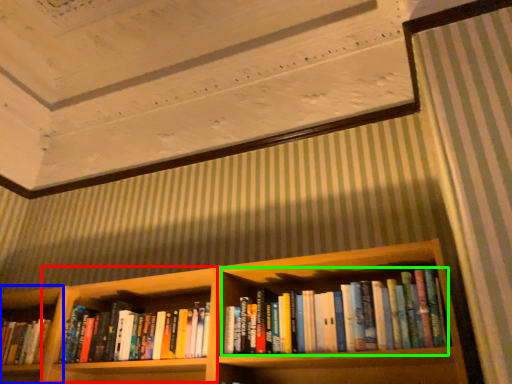
Question: Which is nearer to the cabinet (highlighted by a red box)? shelf (highlighted by a blue box) or book (highlighted by a green box).

Choices:
 (A) shelf
 (B) book

Answer: (A)